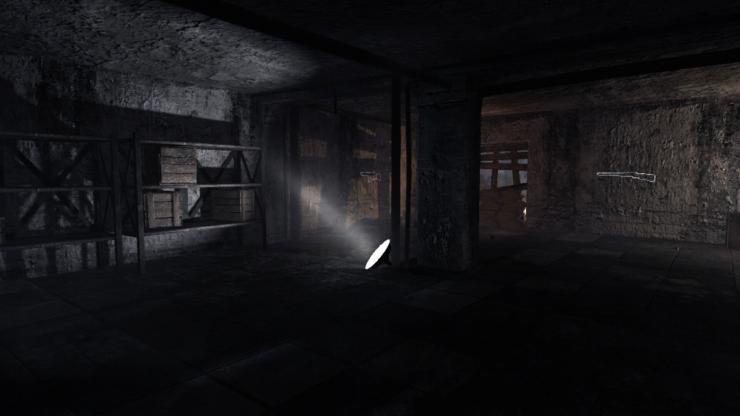
Identify the location of wall. The height and width of the screenshot is (416, 740). click(647, 134).